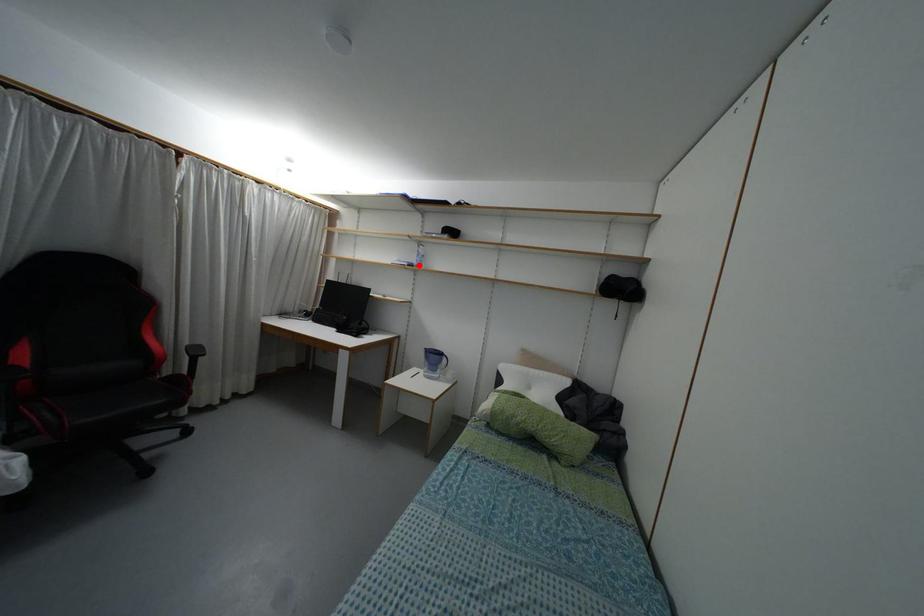
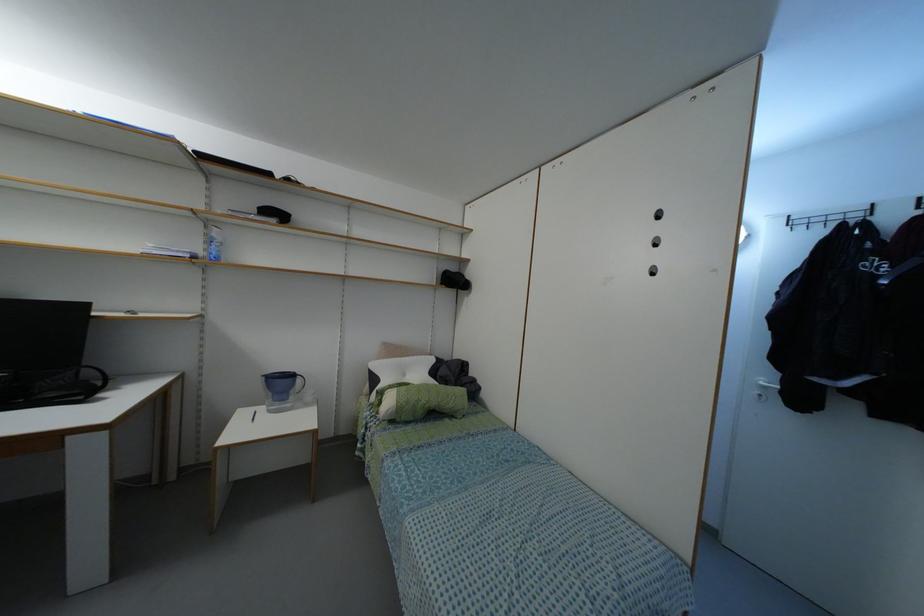
The point at the highlighted location is marked in the first image. Where is the corresponding point in the second image?

(216, 257)